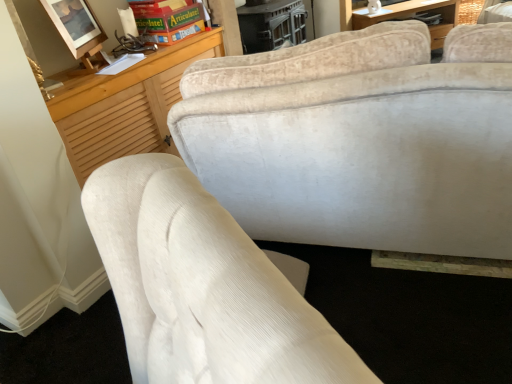
Image resolution: width=512 pixels, height=384 pixels. Identify the location of matte wooden picture frame at upper left. (76, 26).

The height and width of the screenshot is (384, 512). Describe the element at coordinates (76, 26) in the screenshot. I see `matte wooden picture frame at upper left` at that location.

Describe the element at coordinates (168, 20) in the screenshot. I see `green cardboard game at upper center` at that location.

What is the approximate width of green cardboard game at upper center?

It is 11.98 inches.

You are a GUI agent. You are given a task and a screenshot of the screen. Output one action in this format:
    pyautogui.click(x=<x>, y=<y>)
    Task: Click on the green cardboard game at upper center
    The width and height of the screenshot is (512, 384).
    Given the screenshot: What is the action you would take?
    click(168, 20)

Locate an element on the screen. Image resolution: width=512 pixels, height=384 pixels. matte wooden picture frame at upper left is located at coordinates (76, 26).

Which is more to the left, matte wooden picture frame at upper left or green cardboard game at upper center?

matte wooden picture frame at upper left is more to the left.

Consider the image. Which object is further away from the camera, matte wooden picture frame at upper left or green cardboard game at upper center?

green cardboard game at upper center is more distant.

Which is farther, (68, 16) or (189, 17)?

The point (189, 17) is behind.

From the image's perspective, is matte wooden picture frame at upper left beneath green cardboard game at upper center?

Correct, matte wooden picture frame at upper left appears lower than green cardboard game at upper center in the image.

From a real-world perspective, which object rests below the other?

green cardboard game at upper center is physically lower.

Based on the photo, can you confirm if matte wooden picture frame at upper left is thinner than green cardboard game at upper center?

Yes, matte wooden picture frame at upper left is thinner than green cardboard game at upper center.

Based on the photo, considering the sizes of matte wooden picture frame at upper left and green cardboard game at upper center in the image, is matte wooden picture frame at upper left taller or shorter than green cardboard game at upper center?

Clearly, matte wooden picture frame at upper left is taller compared to green cardboard game at upper center.

Considering the sizes of matte wooden picture frame at upper left and green cardboard game at upper center in the image, is matte wooden picture frame at upper left bigger or smaller than green cardboard game at upper center?

Clearly, matte wooden picture frame at upper left is smaller in size than green cardboard game at upper center.

Is matte wooden picture frame at upper left inside or outside of green cardboard game at upper center?

The correct answer is: outside.

Is matte wooden picture frame at upper left beside green cardboard game at upper center?

No, matte wooden picture frame at upper left is not in contact with green cardboard game at upper center.

Is matte wooden picture frame at upper left facing away from green cardboard game at upper center?

No, green cardboard game at upper center is not at the back of matte wooden picture frame at upper left.

Looking at this image, how far apart are matte wooden picture frame at upper left and green cardboard game at upper center?

They are 14.24 inches apart.

You are a GUI agent. You are given a task and a screenshot of the screen. Output one action in this format:
    pyautogui.click(x=<x>, y=<y>)
    Task: Click on the book behind the matte wooden picture frame at upper left
    This screenshot has width=512, height=384.
    Given the screenshot: What is the action you would take?
    pyautogui.click(x=168, y=20)

Considering the relative positions of green cardboard game at upper center and matte wooden picture frame at upper left in the image provided, is green cardboard game at upper center to the left or to the right of matte wooden picture frame at upper left?

green cardboard game at upper center is positioned on matte wooden picture frame at upper left's right side.

Is green cardboard game at upper center behind matte wooden picture frame at upper left?

Yes, green cardboard game at upper center is further from the camera.

Is point (167, 44) closer or farther from the camera than point (72, 48)?

Point (167, 44) is positioned farther from the camera compared to point (72, 48).

From the image's perspective, relative to matte wooden picture frame at upper left, is green cardboard game at upper center above or below?

From the image's perspective, green cardboard game at upper center appears above matte wooden picture frame at upper left.

From a real-world perspective, is green cardboard game at upper center physically located above or below matte wooden picture frame at upper left?

Clearly, from a real-world perspective, green cardboard game at upper center is below matte wooden picture frame at upper left.

Can you confirm if green cardboard game at upper center is thinner than matte wooden picture frame at upper left?

No, green cardboard game at upper center is not thinner than matte wooden picture frame at upper left.

Is green cardboard game at upper center taller or shorter than matte wooden picture frame at upper left?

Considering their sizes, green cardboard game at upper center has less height than matte wooden picture frame at upper left.

Considering the relative sizes of green cardboard game at upper center and matte wooden picture frame at upper left in the image provided, is green cardboard game at upper center bigger than matte wooden picture frame at upper left?

Yes, green cardboard game at upper center is bigger than matte wooden picture frame at upper left.

Choose the correct answer: Is green cardboard game at upper center inside matte wooden picture frame at upper left or outside it?

green cardboard game at upper center cannot be found inside matte wooden picture frame at upper left.

Are green cardboard game at upper center and matte wooden picture frame at upper left far apart?

green cardboard game at upper center is actually quite close to matte wooden picture frame at upper left.

Is green cardboard game at upper center positioned with its back to matte wooden picture frame at upper left?

No, green cardboard game at upper center is not facing the opposite direction of matte wooden picture frame at upper left.

How different are the orientations of green cardboard game at upper center and matte wooden picture frame at upper left in degrees?

They differ by 28.9 degrees in their facing directions.

The width and height of the screenshot is (512, 384). I want to click on book to the right of matte wooden picture frame at upper left, so click(x=168, y=20).

Identify the location of picture frame to the left of green cardboard game at upper center. (76, 26).

Where is `book behind the matte wooden picture frame at upper left`? book behind the matte wooden picture frame at upper left is located at coordinates (168, 20).